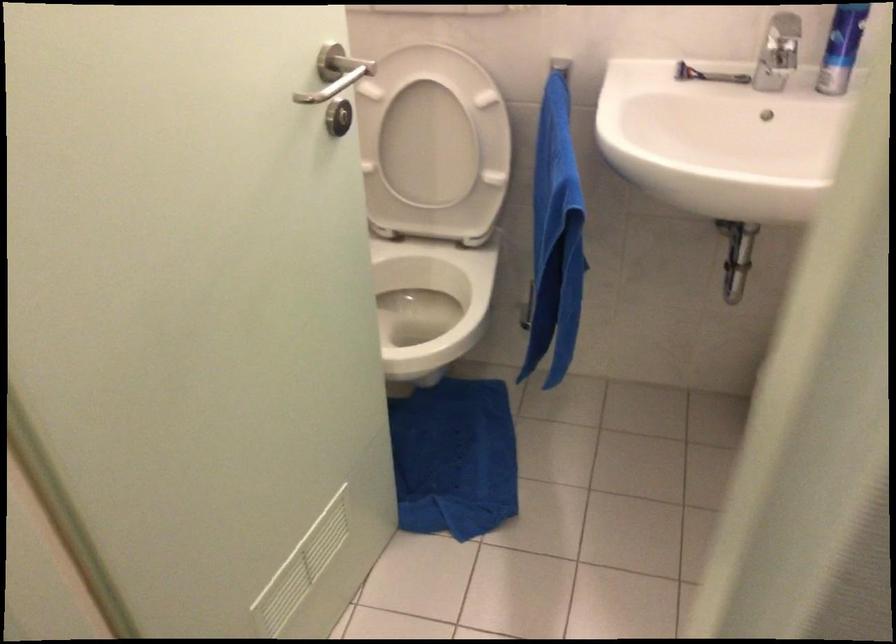
Find where to lift the white toilet seat. Please return your answer as a coordinate pair (x, y).

(424, 149)